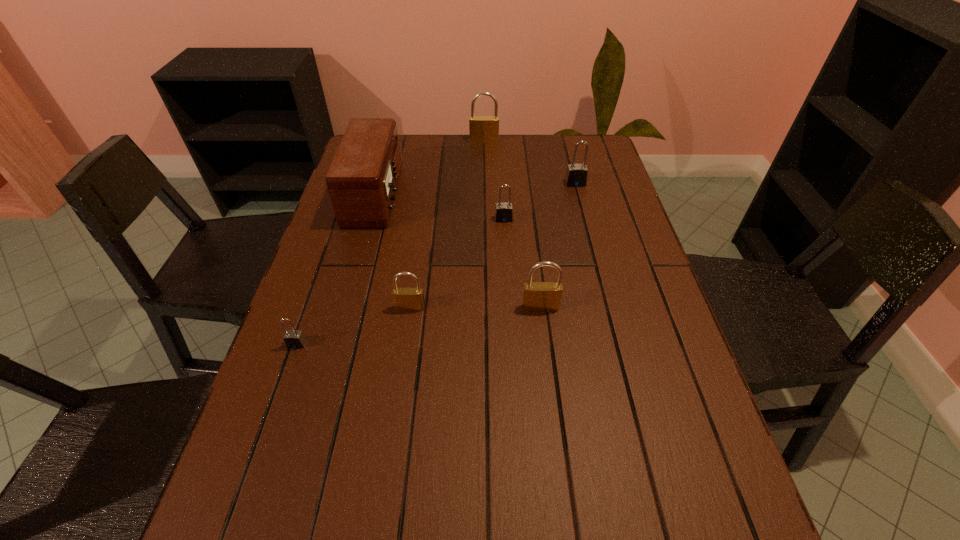
Locate an element on the screen. padlock positioned at the far edge is located at coordinates (483, 129).

Where is `radio receiver that is at the far edge`? This screenshot has height=540, width=960. radio receiver that is at the far edge is located at coordinates (362, 180).

Image resolution: width=960 pixels, height=540 pixels. Identify the location of radio receiver situated at the left edge. (362, 180).

Where is `padlock that is at the left edge`? padlock that is at the left edge is located at coordinates (293, 339).

Find the location of a particular element. Image resolution: width=960 pixels, height=540 pixels. object that is at the right edge is located at coordinates (576, 175).

Locate an element on the screen. The width and height of the screenshot is (960, 540). object located at the far left corner is located at coordinates (362, 180).

This screenshot has height=540, width=960. Find the location of `vacant space at the far edge of the desktop`. vacant space at the far edge of the desktop is located at coordinates (454, 153).

The height and width of the screenshot is (540, 960). I want to click on vacant space at the left edge of the desktop, so click(x=361, y=303).

In the image, there is a desktop. Identify the location of vacant area at the right edge. The width and height of the screenshot is (960, 540). (601, 192).

Where is `vacant space at the far right corner of the desktop`? vacant space at the far right corner of the desktop is located at coordinates (605, 159).